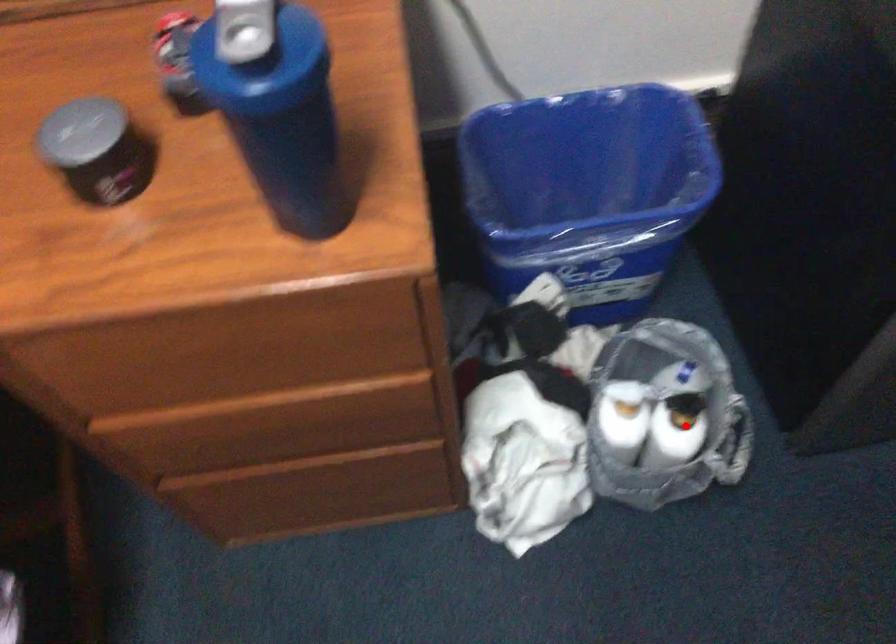
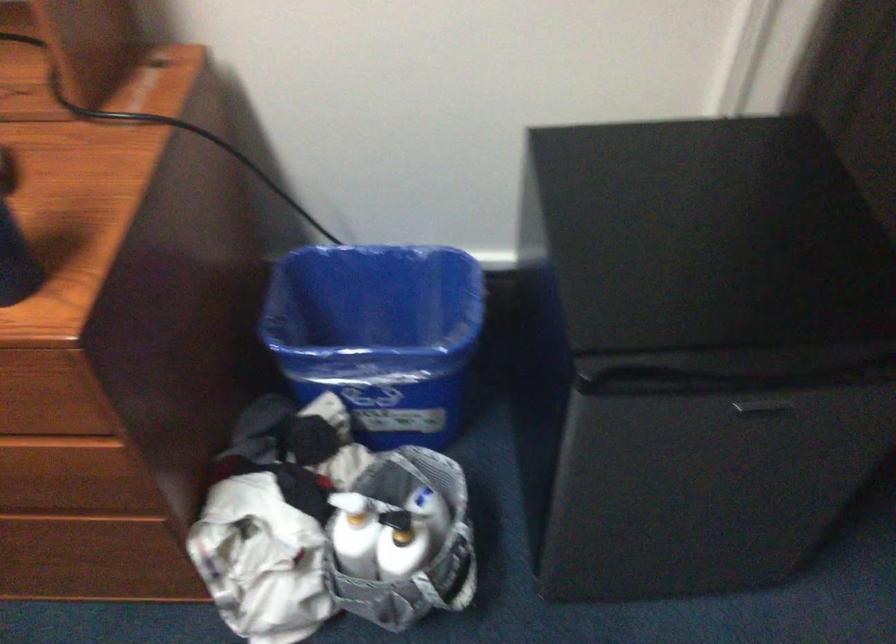
Find the pixel in the second image that matches the highlighted location in the first image.

(401, 544)